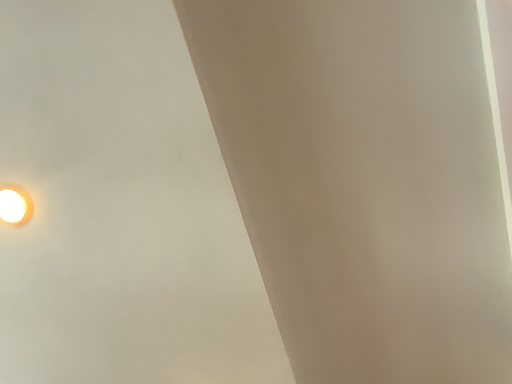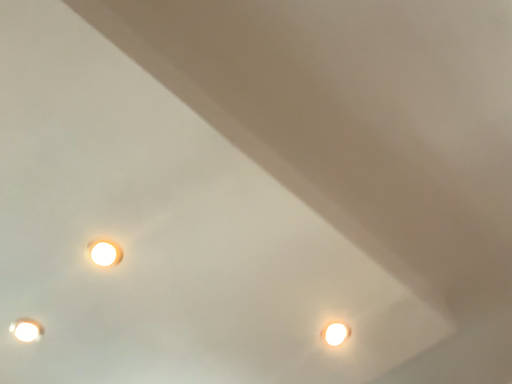
Question: Which way did the camera rotate in the video?

Choices:
 (A) rotated downward
 (B) rotated upward

Answer: (A)